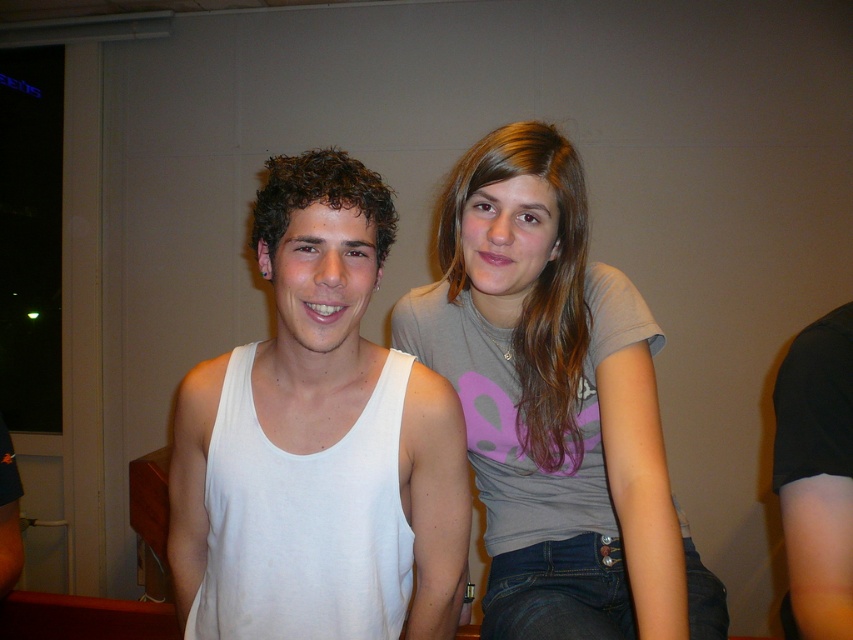
Question: Which point is closer to the camera taking this photo?

Choices:
 (A) (294, 493)
 (B) (520, 198)

Answer: (A)

Question: Where is white matte tank top at center located in relation to gray matte t-shirt at upper right in the image?

Choices:
 (A) right
 (B) left

Answer: (B)

Question: Does white matte tank top at center appear over gray matte t-shirt at upper right?

Choices:
 (A) yes
 (B) no

Answer: (B)

Question: Is white matte tank top at center bigger than gray matte t-shirt at upper right?

Choices:
 (A) no
 (B) yes

Answer: (A)